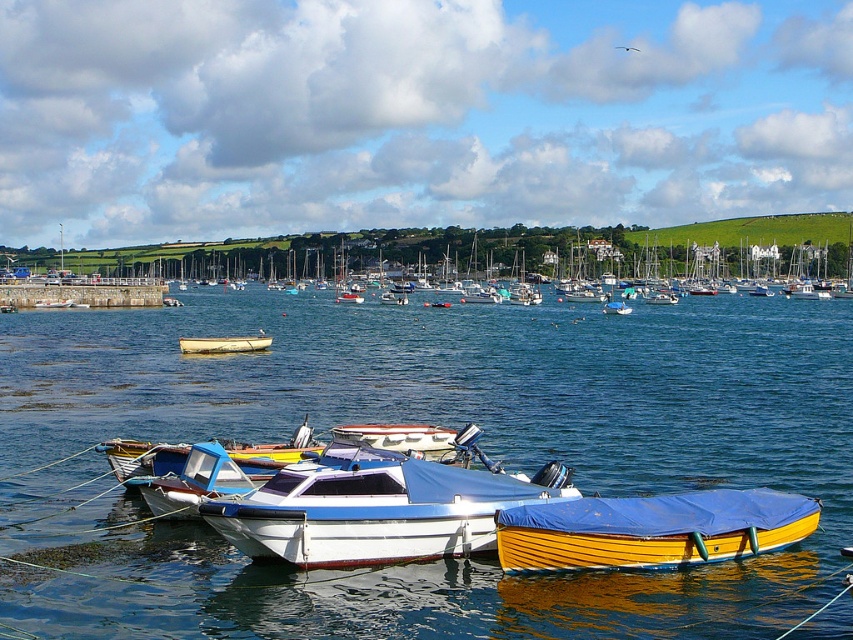
Does blue water at center have a lesser width compared to white glossy motorboat at center?

No.

Does blue water at center appear under white glossy motorboat at center?

No.

Who is more distant from viewer, (390, 621) or (469, 529)?

Point (469, 529)

Locate an element on the screen. blue water at center is located at coordinates (427, 422).

Is blue water at center shorter than white plastic boat at center?

No, blue water at center is not shorter than white plastic boat at center.

Who is more forward, [469,620] or [224,451]?

Point [469,620]

Between point (222, 424) and point (198, 515), which one is positioned behind?

The point (222, 424) is more distant.

Locate an element on the screen. This screenshot has height=640, width=853. blue water at center is located at coordinates (427, 422).

Between white glossy motorboat at center and white wooden rowboat at center, which one is positioned higher?

white wooden rowboat at center is higher up.

Who is more distant from viewer, (248, 529) or (219, 348)?

The point (219, 348) is more distant.

Is point (306, 566) in front of point (224, 339)?

Yes.

Where is `white glossy motorboat at center`? The width and height of the screenshot is (853, 640). white glossy motorboat at center is located at coordinates (378, 508).